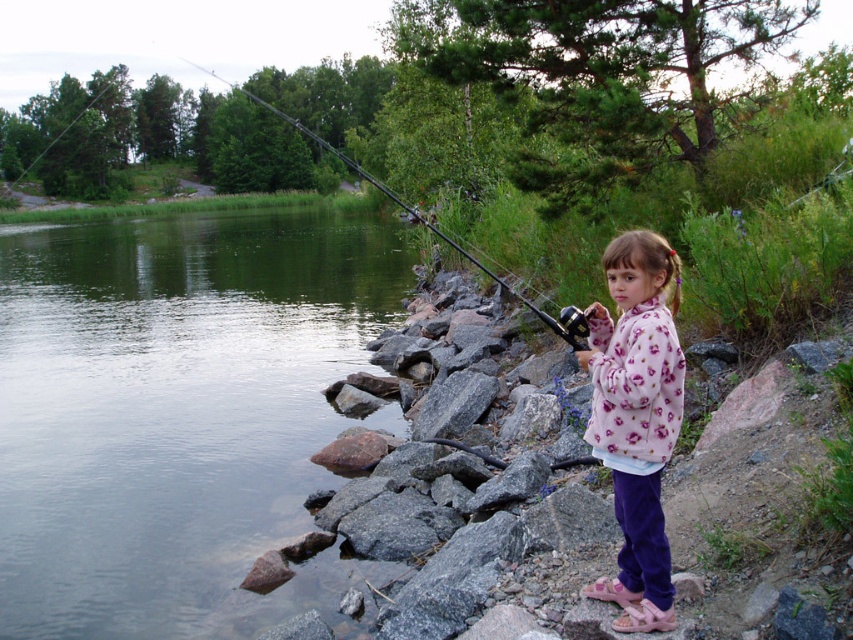
Question: Is green smooth water at left further to the viewer compared to black metallic fishing pole at upper center?

Choices:
 (A) no
 (B) yes

Answer: (B)

Question: Among these objects, which one is farthest from the camera?

Choices:
 (A) fluffy pink sweater at right
 (B) green smooth water at left
 (C) black metallic fishing pole at upper center

Answer: (B)

Question: Among these points, which one is farthest from the camera?

Choices:
 (A) (668, 563)
 (B) (321, 228)
 (C) (480, 268)

Answer: (B)

Question: Among these objects, which one is nearest to the camera?

Choices:
 (A) green smooth water at left
 (B) fluffy pink sweater at right

Answer: (B)

Question: Can you confirm if green smooth water at left is positioned below fluffy pink sweater at right?

Choices:
 (A) yes
 (B) no

Answer: (B)

Question: Does fluffy pink sweater at right come in front of black metallic fishing pole at upper center?

Choices:
 (A) no
 (B) yes

Answer: (B)